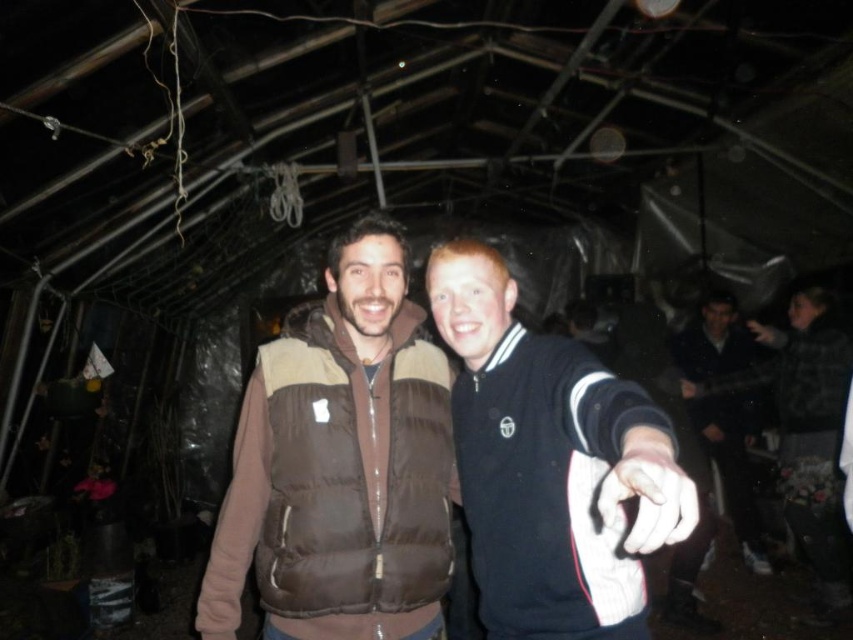
Question: Which point is closer to the camera taking this photo?

Choices:
 (A) [497, 404]
 (B) [663, 496]
 (C) [682, 394]
 (D) [741, 499]

Answer: (B)

Question: Is white matte hand at center behind matte black hand at center?

Choices:
 (A) no
 (B) yes

Answer: (A)

Question: Can you confirm if brown puffy vest at center is wider than matte black hand at upper right?

Choices:
 (A) yes
 (B) no

Answer: (A)

Question: Which of the following is the farthest from the observer?

Choices:
 (A) (682, 381)
 (B) (659, 461)
 (C) (445, 316)
 (D) (424, 372)

Answer: (A)

Question: Which of the following is the closest to the observer?

Choices:
 (A) (634, 524)
 (B) (585, 630)

Answer: (A)

Question: Where is black matte jacket at right located in relation to matte black hand at upper right in the image?

Choices:
 (A) left
 (B) right

Answer: (A)